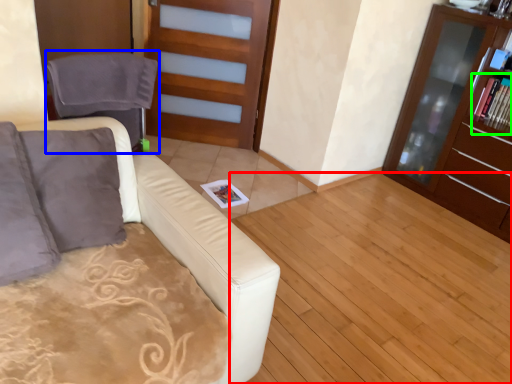
Question: Which is nearer to the hardwood (highlighted by a red box)? swivel chair (highlighted by a blue box) or magazine (highlighted by a green box).

Choices:
 (A) swivel chair
 (B) magazine

Answer: (B)